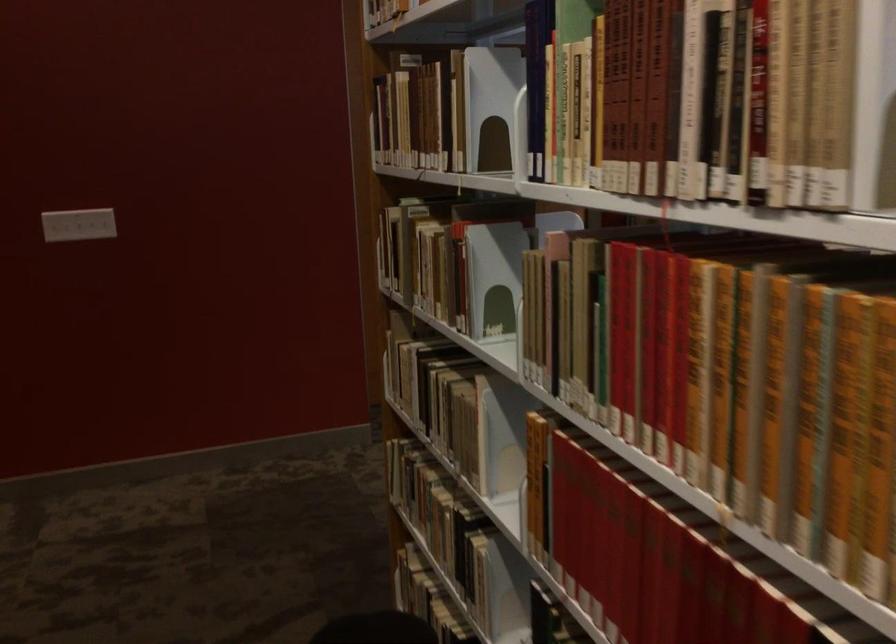
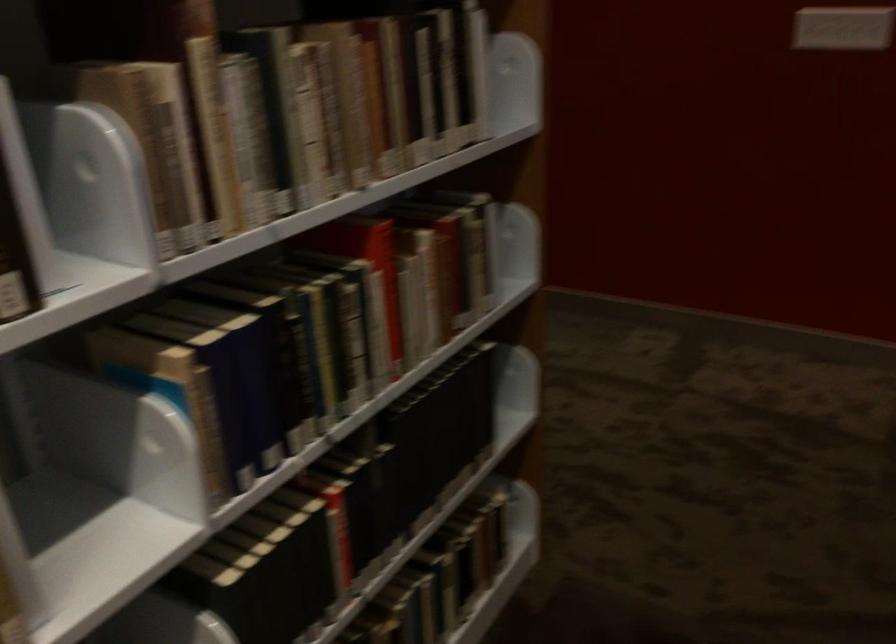
From the picture: How did the camera likely rotate?

The rotation direction of the camera is left-down.